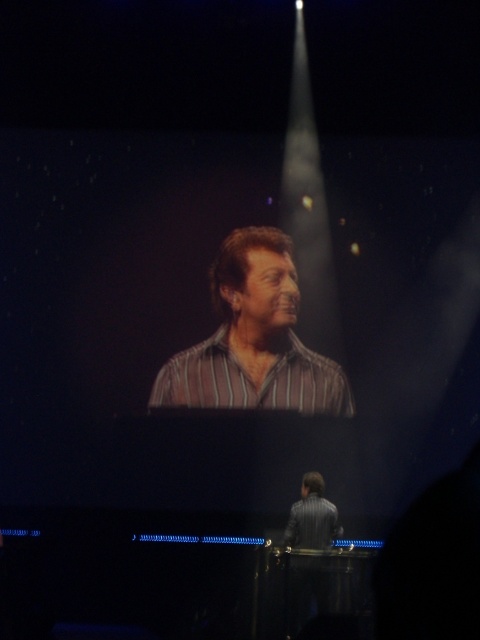
From the picture: You are a photographer standing in the audience. You want to take a photo of the striped shirt at center and the striped cotton shirt at center so that both are clearly visible. Given that your camera has a focus range of 5 inches, can you capture both shirts in one shot without moving the camera?

The striped shirt at center and striped cotton shirt at center are 5.45 inches apart from each other. Since the distance between them exceeds the camera focus range of 5 inches, it might be challenging to capture both shirts clearly in one shot without adjusting the focus or moving the camera.

Based on the coordinates provided, where is the striped shirt at center located in the image?

The striped shirt at center is located at coordinates point (253, 339).

You are a stagehand preparing to place a new spotlight on the stage. You need to ensure it can cover both the striped cotton shirt at center and the striped fabric shirt at lower center. Which shirt requires a wider beam to fully illuminate?

The striped cotton shirt at center requires a wider beam to fully illuminate because it might be wider than the striped fabric shirt at lower center according to the description.